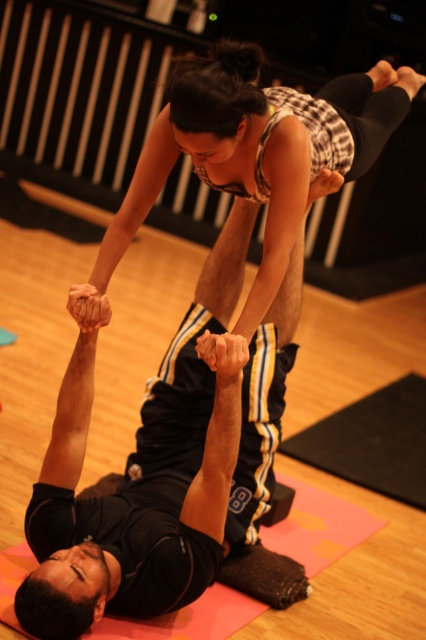
You are a physical therapist evaluating the acrobatic pose in the image. You need to determine if the black matte yoga mat at upper center and the matte black tank top at upper center are positioned in a way that the mat can provide adequate support for the tank top wearer. Based on their heights, can the yoga mat support the tank top wearer?

The black matte yoga mat at upper center is taller than the matte black tank top at upper center, so the yoga mat can provide adequate support for the tank top wearer since it is taller and thus able to accommodate their height.

You are an observer in the dance studio. You see the black matte yoga mat at upper center and the matte black tank top at upper center. Which object is located to the left of the other?

The black matte yoga mat at upper center is positioned on the left side of matte black tank top at upper center.

You are an acrobat planning to place a 20 cm wide prop on the black matte yoga mat at upper center. According to the spatial coordinates provided, can you determine if there is enough space on the mat to place the prop without overlapping other objects?

The black matte yoga mat at upper center is located at point (152,481), but without knowing the dimensions of the mat or the positions of other objects, it is impossible to determine if there is enough space to place the prop without overlapping. Additional information about the mat size and surrounding objects is needed.